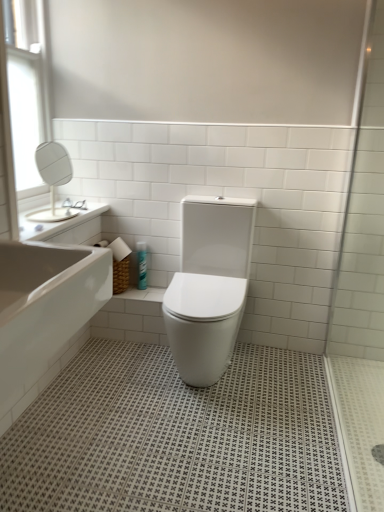
Locate an element on the screen. Image resolution: width=384 pixels, height=512 pixels. vacant space underneath woven brown basket at lower left (from a real-world perspective) is located at coordinates (124, 290).